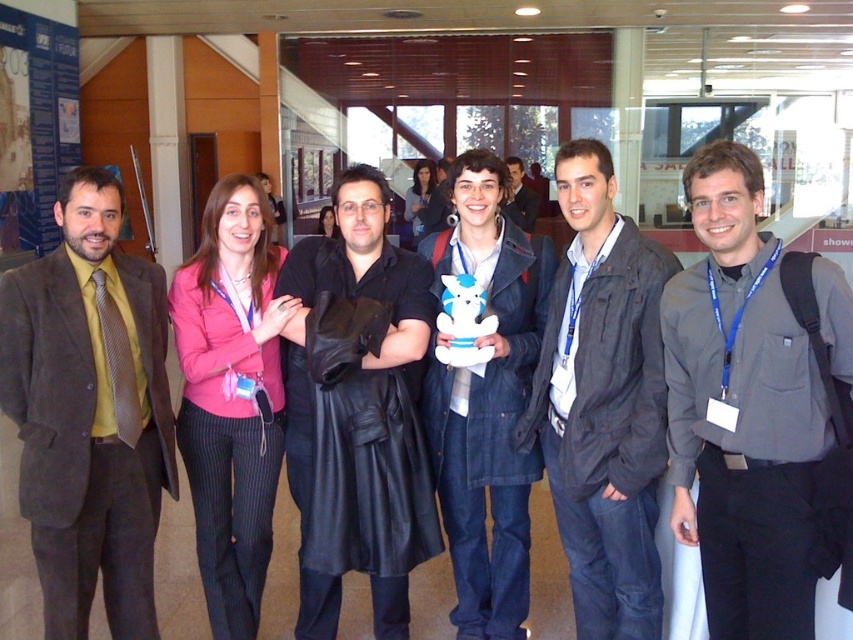
Does black leather coat at center have a lesser width compared to matte black jacket at center?

Incorrect, black leather coat at center's width is not less than matte black jacket at center's.

Between black leather coat at center and matte black jacket at center, which one appears on the right side from the viewer's perspective?

From the viewer's perspective, matte black jacket at center appears more on the right side.

Describe the element at coordinates (357, 410) in the screenshot. I see `black leather coat at center` at that location.

This screenshot has width=853, height=640. Identify the location of black leather coat at center. (357, 410).

Based on the photo, does gray cotton shirt at center have a lesser height compared to pink fabric jacket at center?

Indeed, gray cotton shirt at center has a lesser height compared to pink fabric jacket at center.

Does gray cotton shirt at center have a greater height compared to pink fabric jacket at center?

In fact, gray cotton shirt at center may be shorter than pink fabric jacket at center.

Between point (763, 381) and point (247, 532), which one is positioned in front?

Point (763, 381) is more forward.

Where is `gray cotton shirt at center`? gray cotton shirt at center is located at coordinates (756, 406).

Does suede brown suit at left appear under black leather coat at center?

Incorrect, suede brown suit at left is not positioned below black leather coat at center.

The image size is (853, 640). Describe the element at coordinates (90, 412) in the screenshot. I see `suede brown suit at left` at that location.

Between point (55, 214) and point (334, 268), which one is positioned behind?

The point (334, 268) is behind.

The width and height of the screenshot is (853, 640). What are the coordinates of `suede brown suit at left` in the screenshot? It's located at (90, 412).